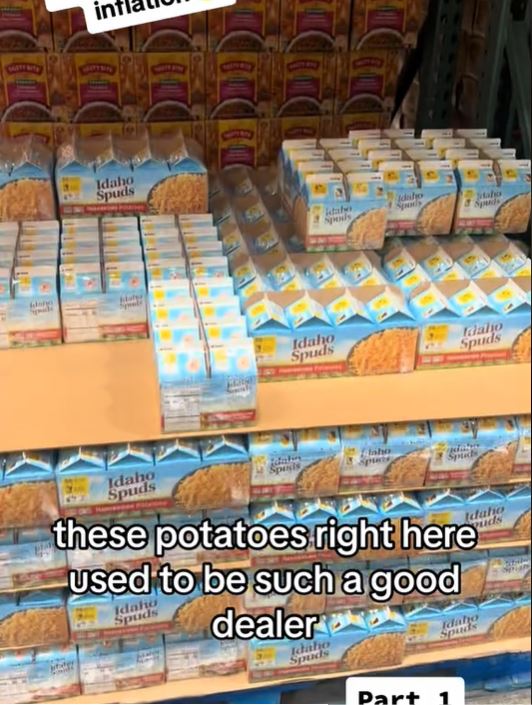
Identify the location of shelf. (195, 685), (107, 409).